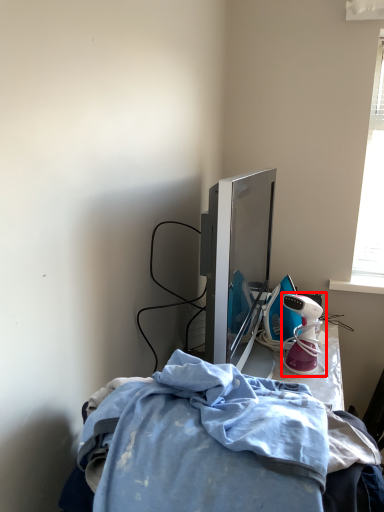
Question: From the image's perspective, considering the relative positions of toy (annotated by the red box) and furniture in the image provided, where is toy (annotated by the red box) located with respect to the staircase?

Choices:
 (A) above
 (B) below

Answer: (A)